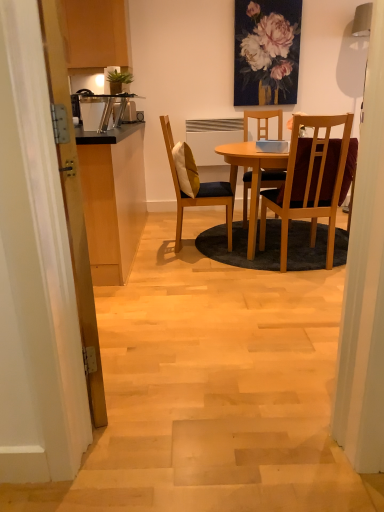
Identify the location of free area behind wooden door at left. (134, 320).